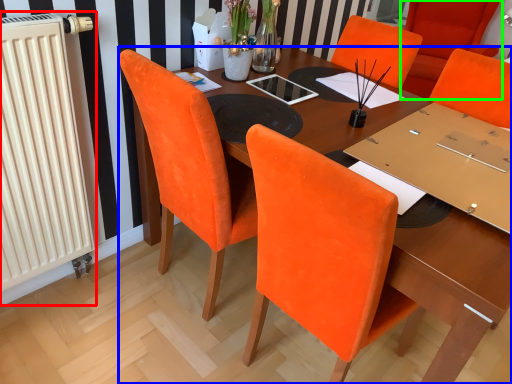
Question: Estimate the real-world distances between objects in this image. Which object is farther from radiator (highlighted by a red box), table (highlighted by a blue box) or chair (highlighted by a green box)?

Choices:
 (A) table
 (B) chair

Answer: (B)